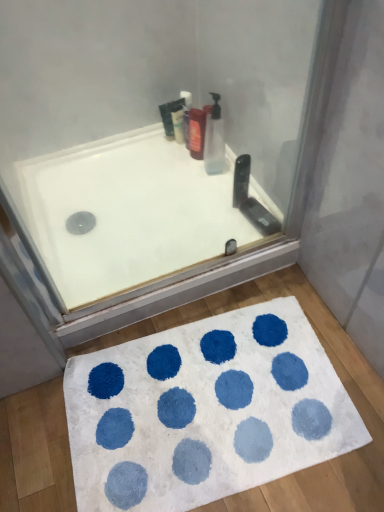
Question: Considering the positions of translucent plastic bottle at upper center, which appears as the 1th cleaning product when viewed from the left, and shiny plastic soap dispenser at upper center in the image, is translucent plastic bottle at upper center, which appears as the 1th cleaning product when viewed from the left, bigger or smaller than shiny plastic soap dispenser at upper center?

Choices:
 (A) small
 (B) big

Answer: (A)

Question: Is translucent plastic bottle at upper center, which is counted as the 1th cleaning product, starting from the back, situated inside shiny plastic soap dispenser at upper center or outside?

Choices:
 (A) outside
 (B) inside

Answer: (A)

Question: Which object is the farthest from the shiny plastic soap dispenser at upper center?

Choices:
 (A) translucent plastic bottle at upper center, which is counted as the 1th cleaning product, starting from the back
 (B) white shaggy bath mat at lower center
 (C) translucent plastic bottle at upper center, which appears as the 2th cleaning product when viewed from the back
 (D) white glossy bathtub at upper center

Answer: (B)

Question: Which object is positioned farthest from the translucent plastic bottle at upper center, which is the second cleaning product in left-to-right order?

Choices:
 (A) translucent plastic bottle at upper center, which is counted as the 1th cleaning product, starting from the back
 (B) white glossy bathtub at upper center
 (C) white shaggy bath mat at lower center
 (D) shiny plastic soap dispenser at upper center

Answer: (C)